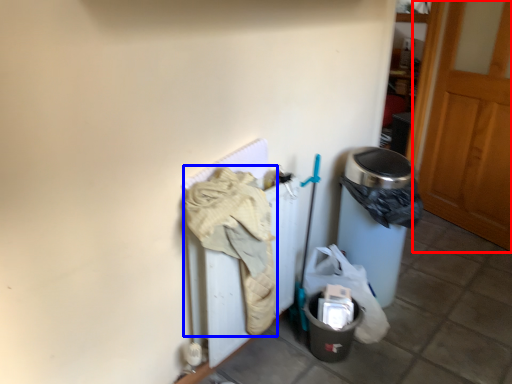
Question: Among these objects, which one is nearest to the camera, door (highlighted by a red box) or clothing (highlighted by a blue box)?

Choices:
 (A) door
 (B) clothing

Answer: (B)